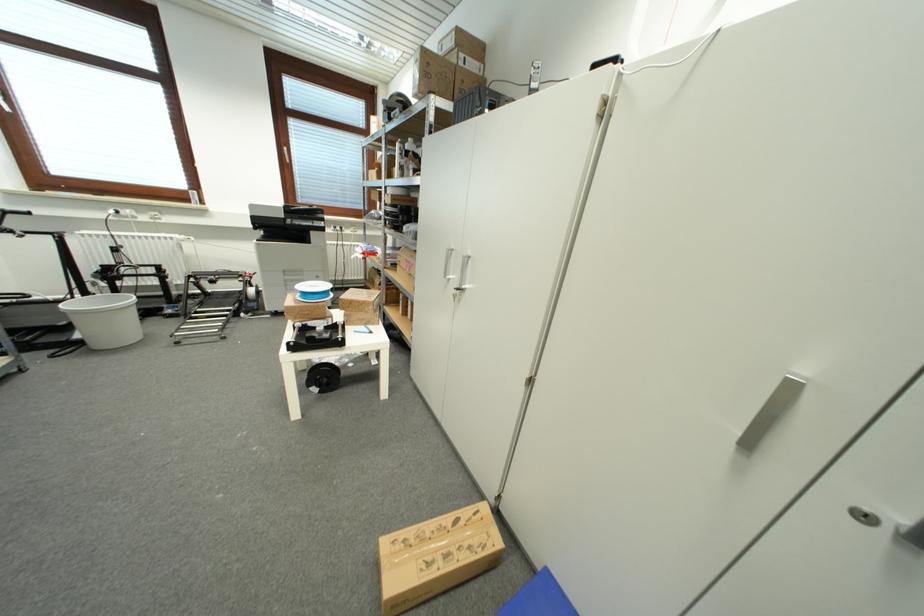
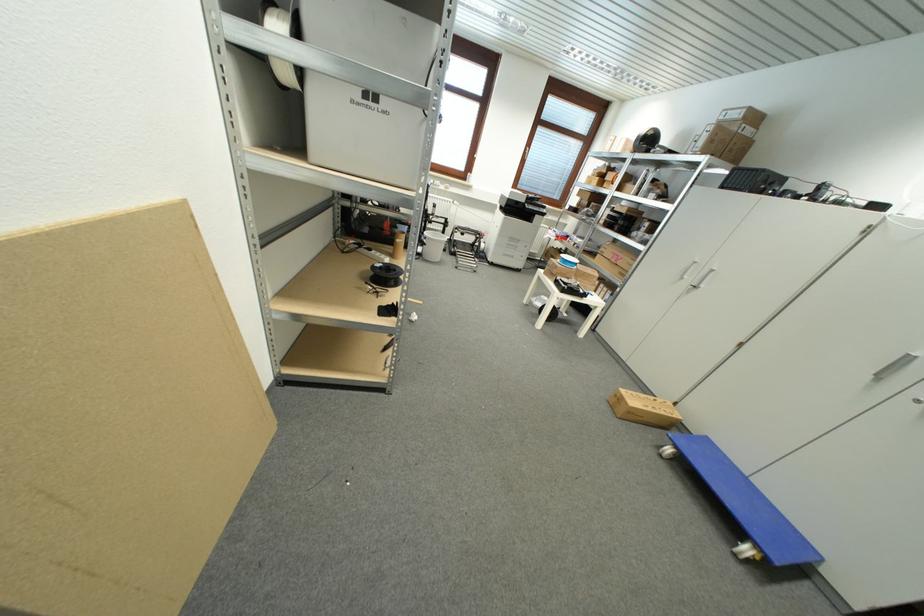
Where in the second image is the point corresponding to point 233,297 from the first image?

(468, 246)